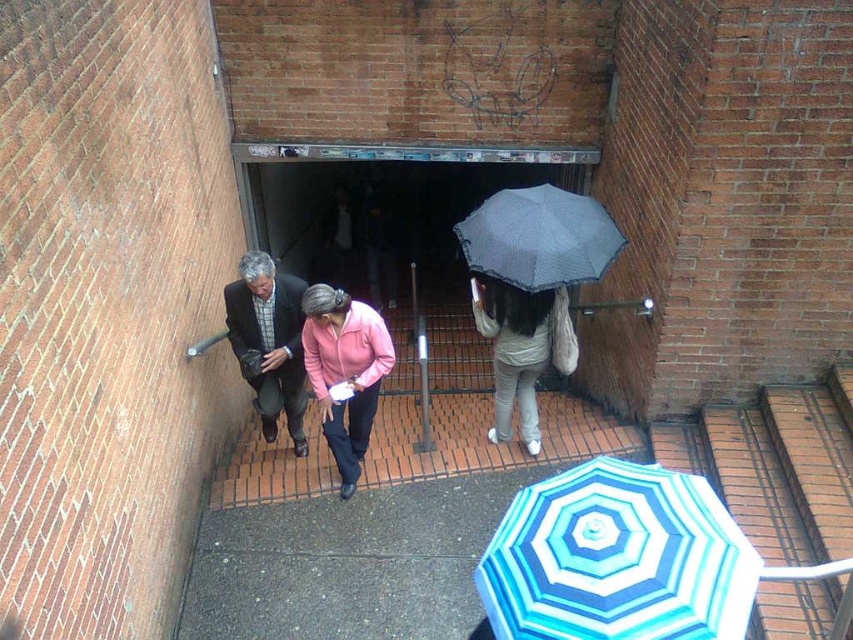
Is point (351, 317) positioned before point (375, 253)?

Yes, it is.

In the scene shown: Is pink matte jacket at center to the right of pink fabric jacket at center from the viewer's perspective?

Indeed, pink matte jacket at center is positioned on the right side of pink fabric jacket at center.

What do you see at coordinates (344, 371) in the screenshot? I see `pink matte jacket at center` at bounding box center [344, 371].

Locate an element on the screen. The height and width of the screenshot is (640, 853). pink matte jacket at center is located at coordinates (344, 371).

Is blue striped fabric umbrella at lower right in front of light pink fabric jacket at center?

That is True.

Can you confirm if blue striped fabric umbrella at lower right is positioned to the right of light pink fabric jacket at center?

Correct, you'll find blue striped fabric umbrella at lower right to the right of light pink fabric jacket at center.

What are the coordinates of `blue striped fabric umbrella at lower right` in the screenshot? It's located at (618, 557).

Is blue striped fabric umbrella at lower right smaller than light gray fabric umbrella at center?

Indeed, blue striped fabric umbrella at lower right has a smaller size compared to light gray fabric umbrella at center.

Where is `blue striped fabric umbrella at lower right`? Image resolution: width=853 pixels, height=640 pixels. blue striped fabric umbrella at lower right is located at coordinates (618, 557).

Between point (589, 612) and point (548, 336), which one is positioned behind?

The point (548, 336) is more distant.

Locate an element on the screen. The height and width of the screenshot is (640, 853). blue striped fabric umbrella at lower right is located at coordinates (618, 557).